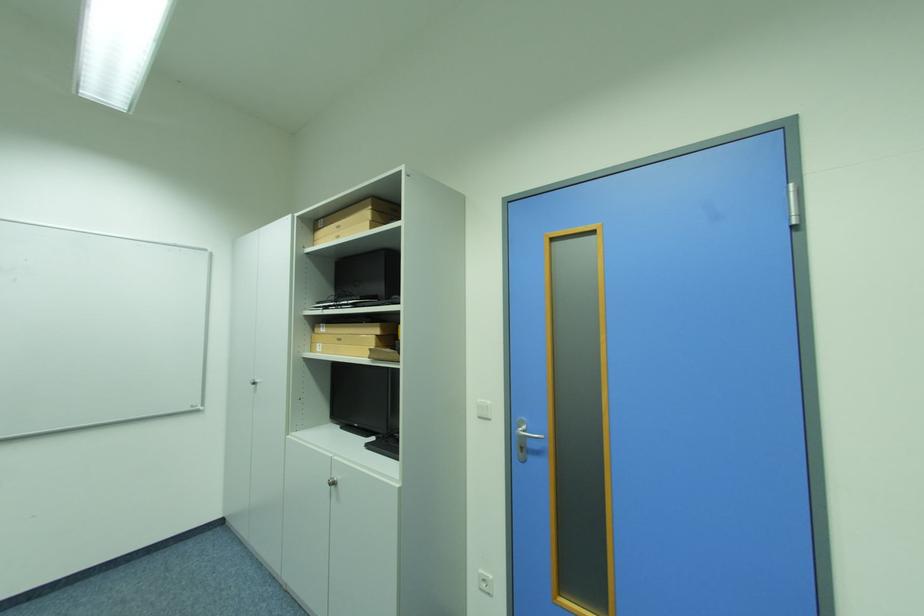
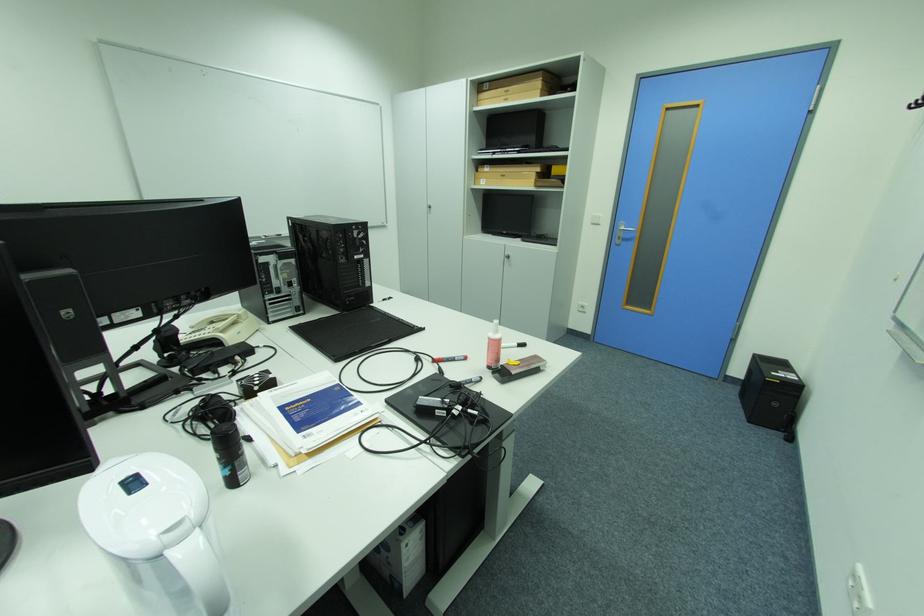
The point at [325,345] is marked in the first image. Where is the corresponding point in the second image?

(490, 180)